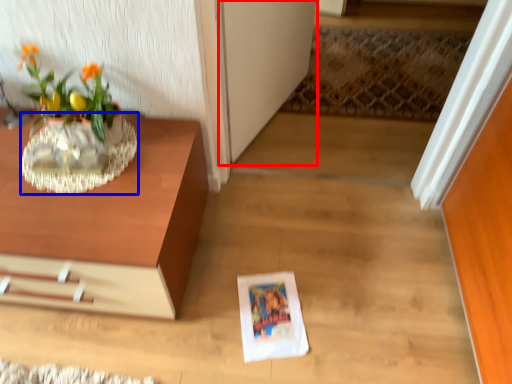
Question: Among these objects, which one is nearest to the camera, glass door (highlighted by a red box) or vase (highlighted by a blue box)?

Choices:
 (A) glass door
 (B) vase

Answer: (B)